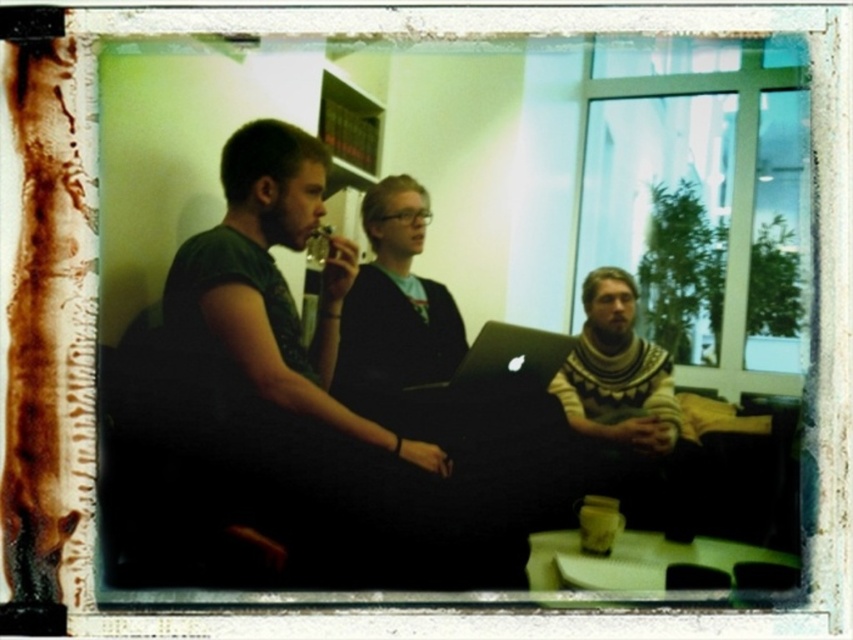
Question: Is green matte shirt at center below knitted sweater at center?

Choices:
 (A) yes
 (B) no

Answer: (B)

Question: Which object is farther from the camera taking this photo?

Choices:
 (A) black matte laptop at center
 (B) knitted sweater at center

Answer: (A)

Question: Which point is farther to the camera?

Choices:
 (A) knitted sweater at center
 (B) green matte shirt at center
 (C) matte black sweater at center

Answer: (C)

Question: Which of the following is the closest to the observer?

Choices:
 (A) (223, 316)
 (B) (485, 352)

Answer: (A)

Question: Considering the relative positions of matte black sweater at center and knitted sweater at center in the image provided, where is matte black sweater at center located with respect to knitted sweater at center?

Choices:
 (A) above
 (B) below

Answer: (A)

Question: In this image, where is green matte shirt at center located relative to black matte laptop at center?

Choices:
 (A) below
 (B) above

Answer: (B)